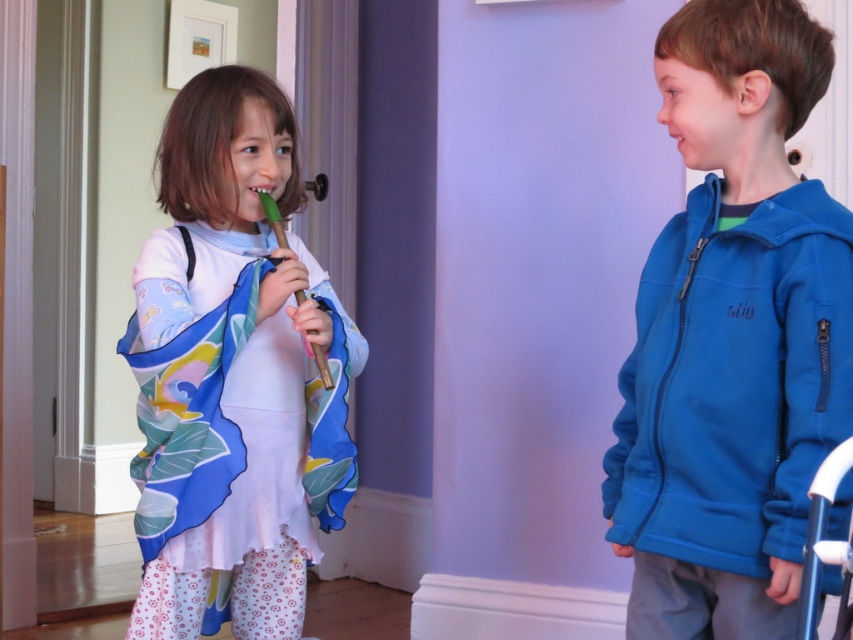
You are a GUI agent. You are given a task and a screenshot of the screen. Output one action in this format:
    pyautogui.click(x=<x>, y=<y>)
    Task: Click on the matte green flute at left
    
    Given the screenshot: What is the action you would take?
    pyautogui.click(x=233, y=376)

Is point (184, 317) positioned after point (677, 150)?

Yes.

Does point (167, 323) come in front of point (689, 134)?

No.

Identify the location of matte green flute at left. Image resolution: width=853 pixels, height=640 pixels. (233, 376).

Describe the element at coordinates (732, 337) in the screenshot. I see `blue fleece jacket at right` at that location.

Is point (833, 276) behind point (192, 314)?

No, it is in front of (192, 314).

I want to click on blue fleece jacket at right, so click(732, 337).

Between green wood toothbrush at center and pink matte mouth at upper center, which one appears on the left side from the viewer's perspective?

green wood toothbrush at center

Does green wood toothbrush at center have a lesser height compared to pink matte mouth at upper center?

No.

Is point (328, 376) farther from viewer compared to point (682, 148)?

Yes.

Locate an element on the screen. Image resolution: width=853 pixels, height=640 pixels. green wood toothbrush at center is located at coordinates [x=273, y=218].